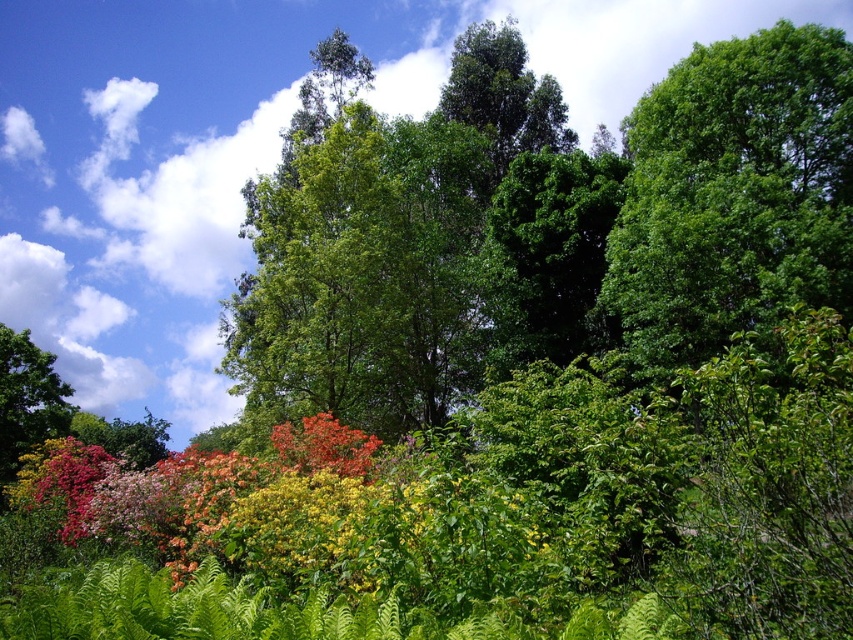
You are a bird flying over the scene and want to land on the multicolored foliage at center. However, there is a green leafy tree at upper right in your path. Can you safely fly through the space between them without hitting anything?

The multicolored foliage at center is behind the green leafy tree at upper right, so the tree is closer to you. You would need to fly around the green leafy tree at upper right to reach the multicolored foliage at center safely.

You are standing in a garden and want to take a photo of the multicolored foliage at center. If your camera has a maximum focus range of 5 meters, will it be able to capture the foliage clearly?

The multicolored foliage at center is 5.55 meters away from the viewer. Since the camera can only focus up to 5 meters, it won compare the distance with the maximum range. The answer is no, the camera cannot capture the foliage clearly because it is beyond the 5 meter range.

Based on the photo, you are planning to plant a new tree in your garden. You have two options from the image shown. Which of the two options, the green leafy tree at upper right or the vivid orange leaves at center, has a wider spread according to the scene?

The green leafy tree at upper right has a wider spread than the vivid orange leaves at center because its width surpasses the latter as described.